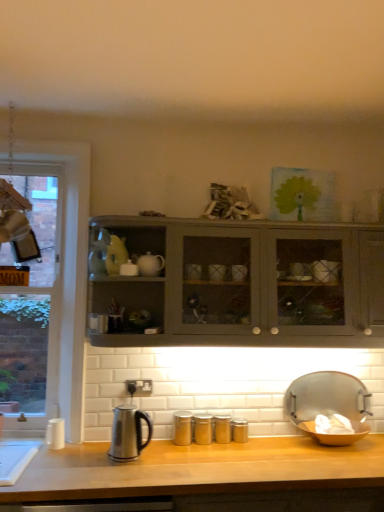
What do you see at coordinates (212, 476) in the screenshot? I see `wooden at center` at bounding box center [212, 476].

Describe the element at coordinates (244, 284) in the screenshot. This screenshot has width=384, height=512. I see `matte gray cabinet at center` at that location.

Find the location of `clear glass window at left`. clear glass window at left is located at coordinates (68, 268).

From a real-world perspective, is metallic silver tray at lower right positioned over stainless steel kettle at lower left based on gravity?

Correct, in the physical world, metallic silver tray at lower right is higher than stainless steel kettle at lower left.

Which object is positioned more to the left, metallic silver tray at lower right or stainless steel kettle at lower left?

stainless steel kettle at lower left.

Is metallic silver tray at lower right positioned with its back to stainless steel kettle at lower left?

No, metallic silver tray at lower right's orientation is not away from stainless steel kettle at lower left.

Could you tell me if stainless steel kettle at lower left is facing clear glass window at left?

No, stainless steel kettle at lower left is not turned towards clear glass window at left.

Is stainless steel kettle at lower left positioned far away from clear glass window at left?

stainless steel kettle at lower left is actually quite close to clear glass window at left.

From the picture: From the image's perspective, between stainless steel kettle at lower left and clear glass window at left, who is located below?

stainless steel kettle at lower left appears lower in the image.

Between stainless steel kettle at lower left and clear glass window at left, which one has smaller size?

With smaller size is stainless steel kettle at lower left.

Based on their positions, is clear glass window at left located to the left or right of stainless steel kettle at lower left?

Clearly, clear glass window at left is on the left of stainless steel kettle at lower left in the image.

Does clear glass window at left have a lesser height compared to stainless steel kettle at lower left?

Incorrect, the height of clear glass window at left does not fall short of that of stainless steel kettle at lower left.

From the image's perspective, between clear glass window at left and stainless steel kettle at lower left, which one is located above?

clear glass window at left, from the image's perspective.

From a real-world perspective, is clear glass window at left above or below stainless steel kettle at lower left?

From a real-world perspective, clear glass window at left is physically above stainless steel kettle at lower left.

Find the location of `window on the left of matte gray cabinet at center`. window on the left of matte gray cabinet at center is located at coordinates (68, 268).

Which is more to the left, clear glass window at left or matte gray cabinet at center?

From the viewer's perspective, clear glass window at left appears more on the left side.

Can you confirm if clear glass window at left is shorter than matte gray cabinet at center?

In fact, clear glass window at left may be taller than matte gray cabinet at center.

Considering the positions of objects matte gray cabinet at center and metallic silver tray at lower right in the image provided, who is more to the right, matte gray cabinet at center or metallic silver tray at lower right?

metallic silver tray at lower right.

From a real-world perspective, which object stands above the other?

From a 3D spatial view, matte gray cabinet at center is above.

Looking at this image, from the image's perspective, who appears lower, matte gray cabinet at center or metallic silver tray at lower right?

→ metallic silver tray at lower right, from the image's perspective.

Is matte gray cabinet at center further to camera compared to metallic silver tray at lower right?

No, matte gray cabinet at center is closer to the viewer.

Is there a large distance between wooden at center and metallic silver tray at lower right?

That's not correct — wooden at center is a little close to metallic silver tray at lower right.

Which of these two, wooden at center or metallic silver tray at lower right, is bigger?

wooden at center.

Consider the image. Is wooden at center facing towards metallic silver tray at lower right?

No, wooden at center is not turned towards metallic silver tray at lower right.

Where is `appliance on the right of the wooden at center`? appliance on the right of the wooden at center is located at coordinates (329, 407).

From the image's perspective, is wooden at center above or below stainless steel kettle at lower left?

Clearly, from the image's perspective, wooden at center is below stainless steel kettle at lower left.

Relative to stainless steel kettle at lower left, is wooden at center in front or behind?

Clearly, wooden at center is in front of stainless steel kettle at lower left.

At what (x,y) coordinates should I click in order to perform the action: click on kitchen appliance above the wooden at center (from the image's perspective). Please return your answer as a coordinate pair (x, y). Image resolution: width=384 pixels, height=512 pixels. Looking at the image, I should click on (128, 433).

The width and height of the screenshot is (384, 512). Find the location of `appliance behind the stainless steel kettle at lower left`. appliance behind the stainless steel kettle at lower left is located at coordinates (329, 407).

Identify the location of window above the stainless steel kettle at lower left (from the image's perspective). This screenshot has width=384, height=512. (68, 268).

Based on their spatial positions, is stainless steel kettle at lower left or matte gray cabinet at center closer to clear glass window at left?

Among the two, stainless steel kettle at lower left is located nearer to clear glass window at left.

When comparing their distances from matte gray cabinet at center, does metallic silver tray at lower right or stainless steel kettle at lower left seem closer?

metallic silver tray at lower right lies closer to matte gray cabinet at center than the other object.

When comparing their distances from matte gray cabinet at center, does clear glass window at left or metallic silver tray at lower right seem closer?

metallic silver tray at lower right is closer to matte gray cabinet at center.

Looking at the image, which one is located closer to clear glass window at left, metallic silver tray at lower right or wooden at center?

Based on the image, wooden at center appears to be nearer to clear glass window at left.

Estimate the real-world distances between objects in this image. Which object is closer to clear glass window at left, stainless steel kettle at lower left or metallic silver tray at lower right?

The object closer to clear glass window at left is stainless steel kettle at lower left.

Estimate the real-world distances between objects in this image. Which object is further from stainless steel kettle at lower left, clear glass window at left or matte gray cabinet at center?

Among the two, matte gray cabinet at center is located further to stainless steel kettle at lower left.

Based on their spatial positions, is metallic silver tray at lower right or stainless steel kettle at lower left further from wooden at center?

metallic silver tray at lower right lies further to wooden at center than the other object.

From the image, which object appears to be farther from stainless steel kettle at lower left, wooden at center or matte gray cabinet at center?

matte gray cabinet at center is positioned further to the anchor stainless steel kettle at lower left.

Find the location of a particular element. The width and height of the screenshot is (384, 512). kitchen appliance between clear glass window at left and matte gray cabinet at center is located at coordinates (128, 433).

Image resolution: width=384 pixels, height=512 pixels. I want to click on cabinetry between clear glass window at left and metallic silver tray at lower right in the horizontal direction, so click(244, 284).

The image size is (384, 512). What are the coordinates of `appliance between matte gray cabinet at center and wooden at center in the up-down direction` in the screenshot? It's located at (329, 407).

The image size is (384, 512). What are the coordinates of `countertop between stainless steel kettle at lower left and metallic silver tray at lower right from left to right` in the screenshot? It's located at (212, 476).